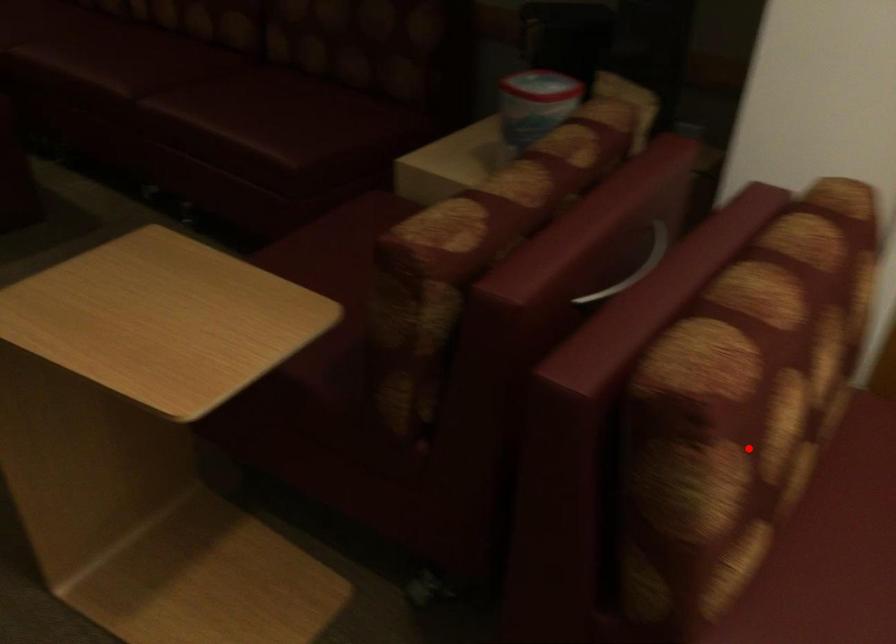
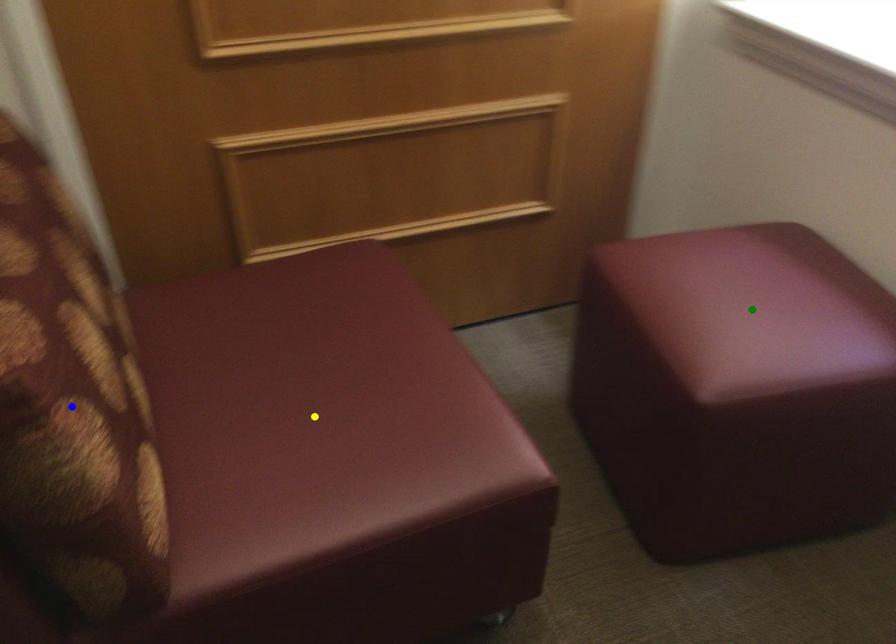
Question: I am providing you with two images of the same scene from different viewpoints. A red point is marked on the first image. You are given multiple points on the second image. Which mark in image 2 goes with the point in image 1?

Choices:
 (A) blue point
 (B) yellow point
 (C) green point

Answer: (A)